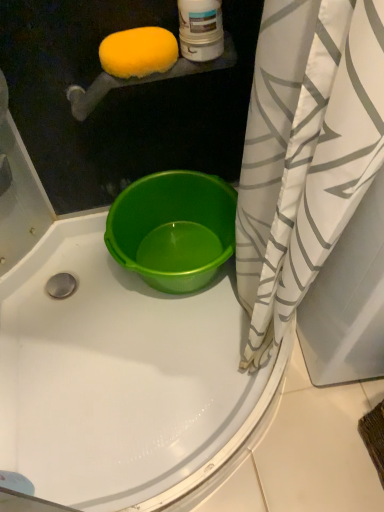
Question: Can you confirm if yellow sponge at upper left is shorter than green plastic bucket at center?

Choices:
 (A) yes
 (B) no

Answer: (A)

Question: From a real-world perspective, is yellow sponge at upper left positioned over green plastic bucket at center based on gravity?

Choices:
 (A) no
 (B) yes

Answer: (B)

Question: Is green plastic bucket at center at the back of yellow sponge at upper left?

Choices:
 (A) yes
 (B) no

Answer: (B)

Question: Considering the relative sizes of yellow sponge at upper left and green plastic bucket at center in the image provided, is yellow sponge at upper left bigger than green plastic bucket at center?

Choices:
 (A) no
 (B) yes

Answer: (A)

Question: Is yellow sponge at upper left to the right of green plastic bucket at center from the viewer's perspective?

Choices:
 (A) yes
 (B) no

Answer: (B)

Question: Based on their positions, is green plastic bucket at center located to the left or right of yellow sponge at upper left?

Choices:
 (A) right
 (B) left

Answer: (A)

Question: In the image, is green plastic bucket at center positioned in front of or behind yellow sponge at upper left?

Choices:
 (A) front
 (B) behind

Answer: (B)

Question: Is point (190, 262) closer or farther from the camera than point (130, 32)?

Choices:
 (A) closer
 (B) farther

Answer: (B)

Question: From a real-world perspective, is green plastic bucket at center positioned above or below yellow sponge at upper left?

Choices:
 (A) below
 (B) above

Answer: (A)

Question: From the image's perspective, is white/gray striped shower curtain at right above or below green plastic bucket at center?

Choices:
 (A) above
 (B) below

Answer: (A)

Question: Would you say white/gray striped shower curtain at right is to the left or to the right of green plastic bucket at center in the picture?

Choices:
 (A) left
 (B) right

Answer: (B)

Question: From a real-world perspective, relative to green plastic bucket at center, is white/gray striped shower curtain at right vertically above or below?

Choices:
 (A) above
 (B) below

Answer: (A)

Question: Considering the positions of white/gray striped shower curtain at right and green plastic bucket at center in the image, is white/gray striped shower curtain at right taller or shorter than green plastic bucket at center?

Choices:
 (A) short
 (B) tall

Answer: (B)

Question: From a real-world perspective, is green plastic bucket at center positioned above or below white/gray striped shower curtain at right?

Choices:
 (A) above
 (B) below

Answer: (B)

Question: Choose the correct answer: Is green plastic bucket at center inside white/gray striped shower curtain at right or outside it?

Choices:
 (A) inside
 (B) outside

Answer: (B)